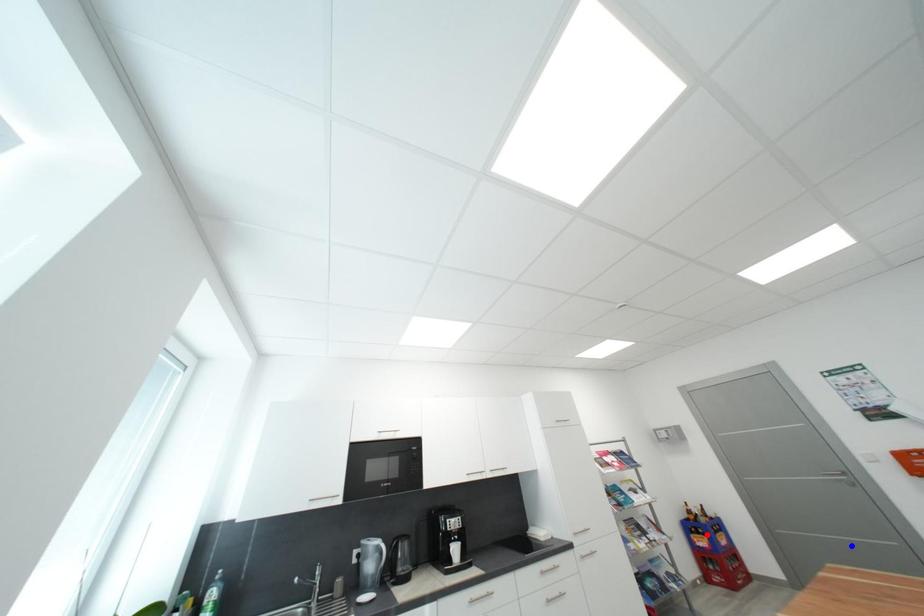
Question: In the image, two points are highlighted. Which point is nearer to the camera? Reply with the corresponding letter.

Choices:
 (A) blue point
 (B) red point

Answer: (A)